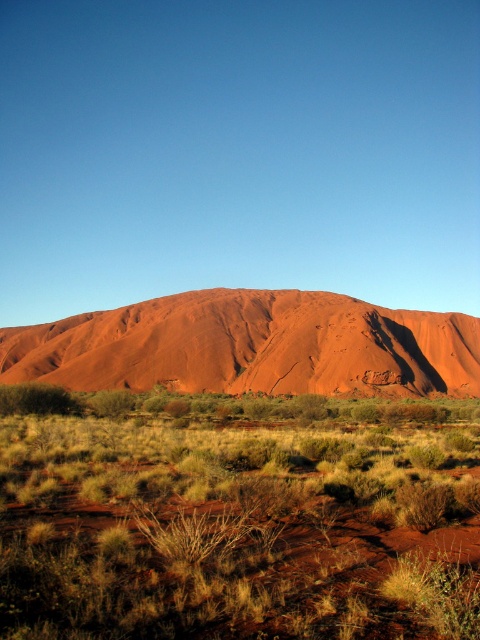
You are a hiker planning to cross the desert and have to choose between two paths. One path is near the dry grass at lower center and the other is near the rustic sandstone mountain at center. Which path would you choose if you want to minimize the distance you walk?

The dry grass at lower center has a lesser width compared to the rustic sandstone mountain at center, so the path near the dry grass at lower center would require walking a shorter distance.

You are standing at the base of Uluru and want to find a spot to place a small camera tripod. The dry grass at lower center is located at point (238,518). Can you confirm if this point is suitable for placing the tripod?

The dry grass at lower center is located at point (238,518), so yes, this point is suitable for placing the tripod as it is a clear location with dry grass.

You are standing at the base of Uluru and see two points marked in the image. The first point is at coordinate point (x=259, y=440) and the second is at point (x=113, y=376). Which point is closer to you?

Point (x=259, y=440) is in front of point (x=113, y=376), so the first point is closer to you.